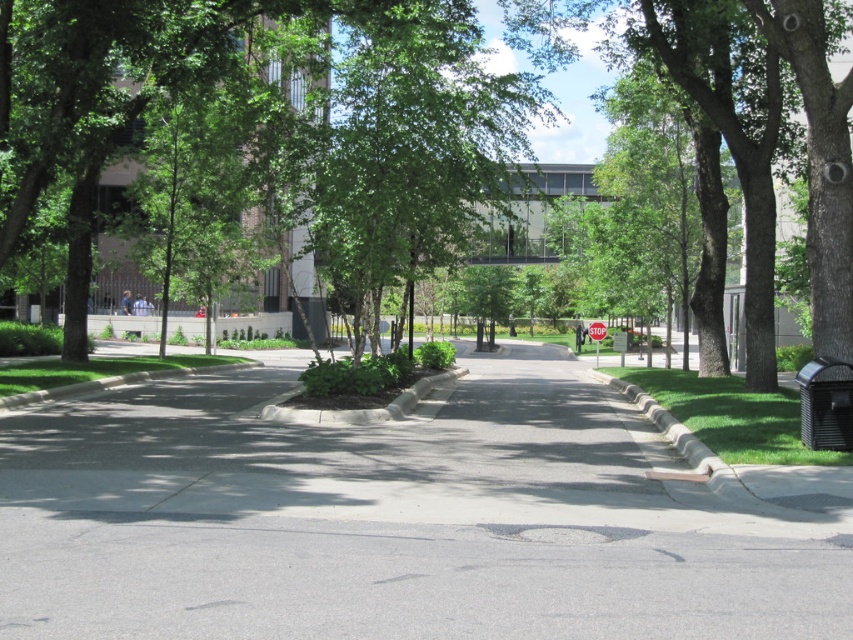
Does point (363, 435) lie in front of point (634, 35)?

Yes, it is in front of point (634, 35).

Which is above, gray asphalt pavement at center or green leafy tree at center?

green leafy tree at center is above.

Measure the distance between gray asphalt pavement at center and camera.

gray asphalt pavement at center is 4.92 meters away from camera.

At what (x,y) coordinates should I click in order to perform the action: click on gray asphalt pavement at center. Please return your answer as a coordinate pair (x, y). The width and height of the screenshot is (853, 640). Looking at the image, I should click on (392, 518).